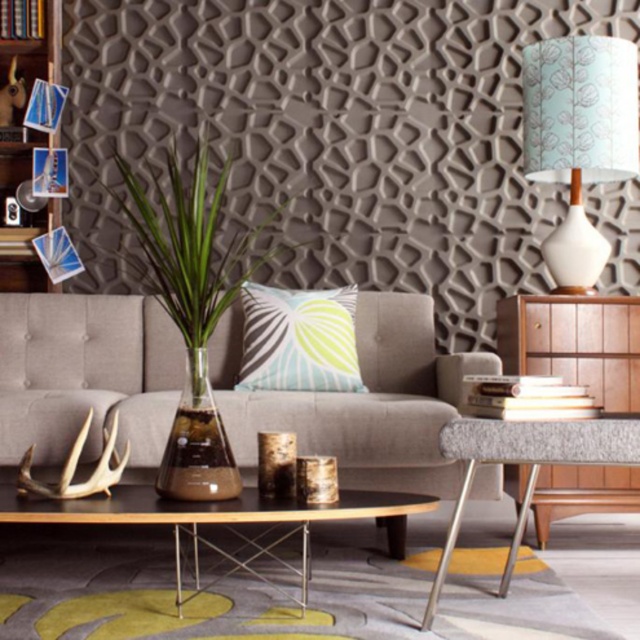
You are standing in the living room and see the point at coordinates (579, 138). Based on the scene description, can you identify which object this point is located on?

The point at coordinates (579, 138) is located on the white fabric lampshade at upper right.